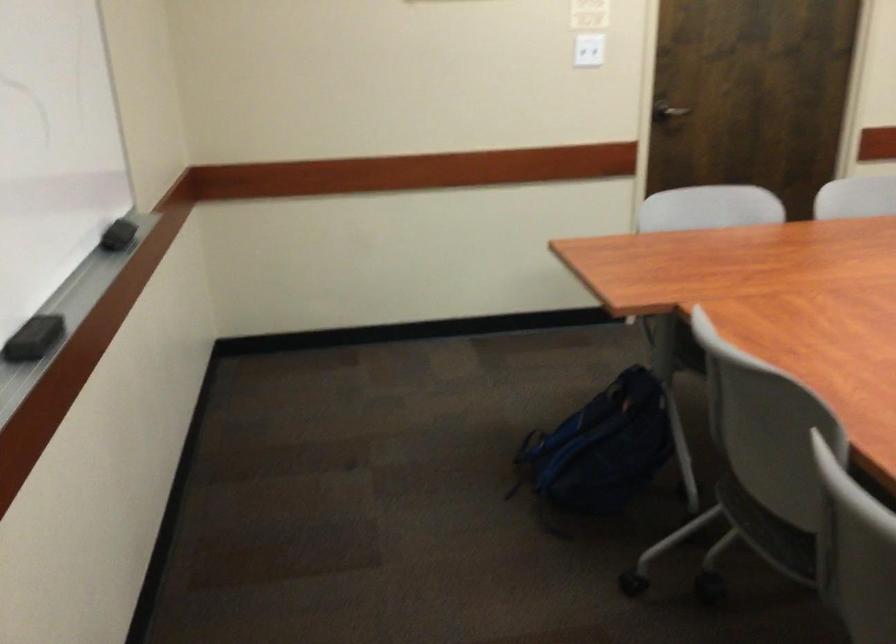
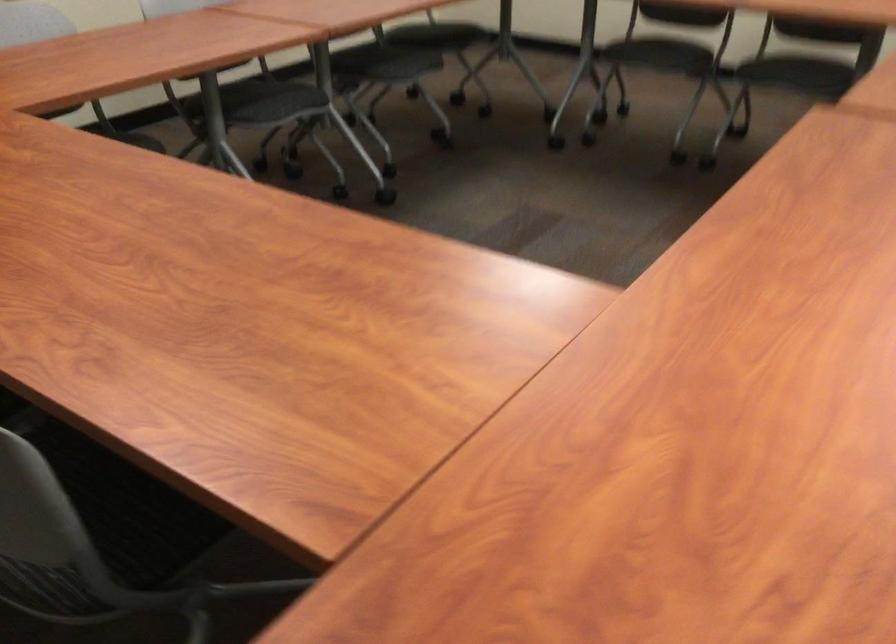
Question: The camera is either moving clockwise (left) or counter-clockwise (right) around the object. The first image is from the beginning of the video and the second image is from the end. Is the camera moving left or right when shooting the video?

Choices:
 (A) Left
 (B) Right

Answer: (A)